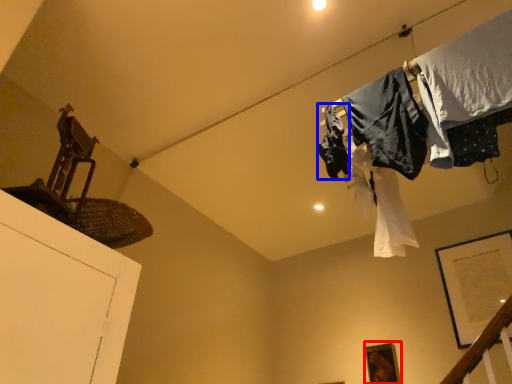
Question: Which point is further to the camera, picture frame (highlighted by a red box) or clothing (highlighted by a blue box)?

Choices:
 (A) picture frame
 (B) clothing

Answer: (A)